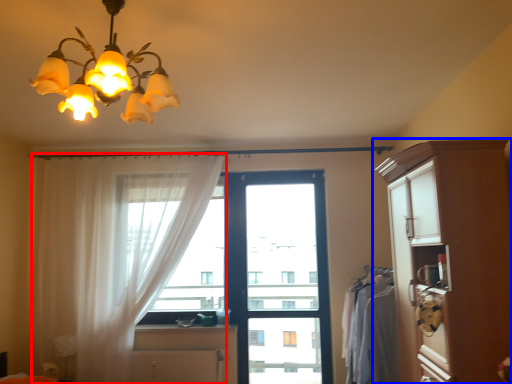
Question: Which of the following is the farthest to the observer, curtain (highlighted by a red box) or cabinetry (highlighted by a blue box)?

Choices:
 (A) curtain
 (B) cabinetry

Answer: (A)